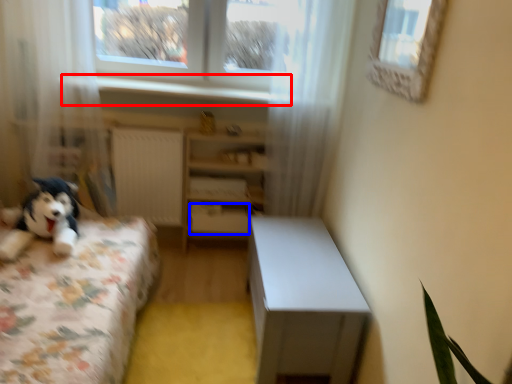
Question: Which point is closer to the camera, window sill (highlighted by a red box) or drawer (highlighted by a blue box)?

Choices:
 (A) window sill
 (B) drawer

Answer: (A)